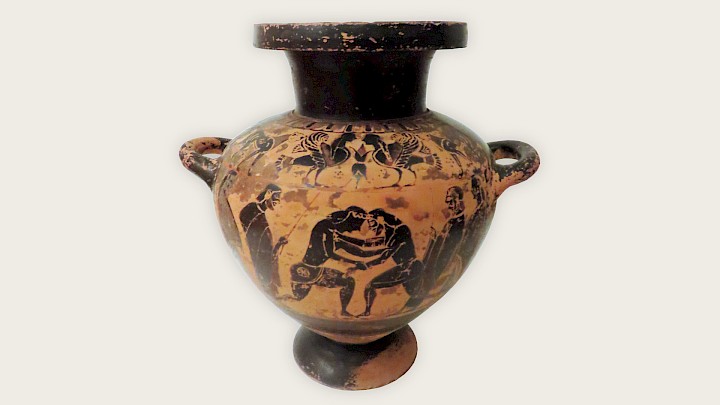
At what (x,y) coordinates should I click in order to perform the action: click on left handle. Please return your answer as a coordinate pair (x, y). This screenshot has width=720, height=405. Looking at the image, I should click on (183, 145).